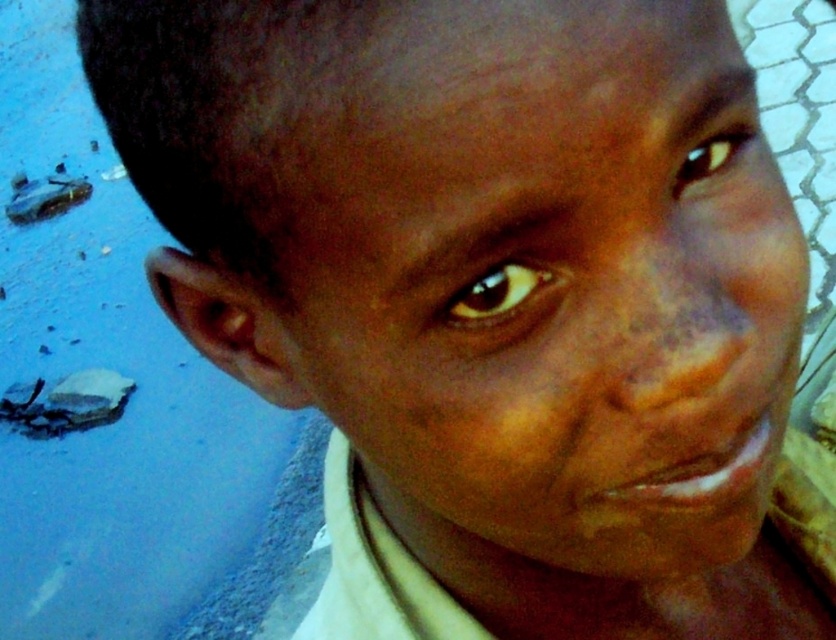
Which is below, smooth skin face at center or brown glossy eye at center?

smooth skin face at center is lower down.

Can you confirm if smooth skin face at center is shorter than brown glossy eye at center?

In fact, smooth skin face at center may be taller than brown glossy eye at center.

Does point (615, 442) come farther from viewer compared to point (447, 323)?

Yes, it is behind point (447, 323).

Image resolution: width=836 pixels, height=640 pixels. Identify the location of smooth skin face at center. (544, 292).

Does brown glossy eye at center have a greater width compared to brown matte eye at upper right?

In fact, brown glossy eye at center might be narrower than brown matte eye at upper right.

At what (x,y) coordinates should I click in order to perform the action: click on brown glossy eye at center. Please return your answer as a coordinate pair (x, y). The width and height of the screenshot is (836, 640). Looking at the image, I should click on (496, 294).

At what (x,y) coordinates should I click in order to perform the action: click on brown glossy eye at center. Please return your answer as a coordinate pair (x, y). Looking at the image, I should click on (496, 294).

Can you confirm if smooth skin face at center is smaller than brown matte eye at upper right?

Incorrect, smooth skin face at center is not smaller in size than brown matte eye at upper right.

You are a GUI agent. You are given a task and a screenshot of the screen. Output one action in this format:
    pyautogui.click(x=<x>, y=<y>)
    Task: Click on the smooth skin face at center
    Image resolution: width=836 pixels, height=640 pixels.
    Given the screenshot: What is the action you would take?
    pyautogui.click(x=544, y=292)

The image size is (836, 640). Find the location of `smooth skin face at center`. smooth skin face at center is located at coordinates (544, 292).